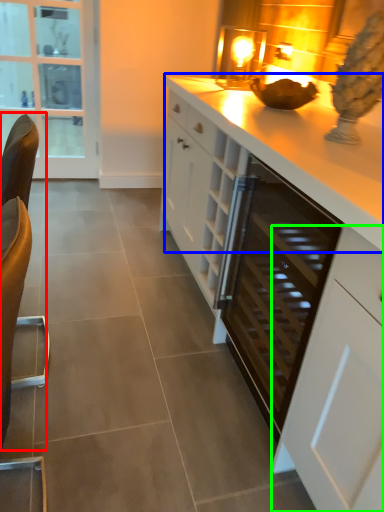
Question: Considering the real-world distances, which object is closest to swivel chair (highlighted by a red box)? countertop (highlighted by a blue box) or cabinetry (highlighted by a green box).

Choices:
 (A) countertop
 (B) cabinetry

Answer: (B)